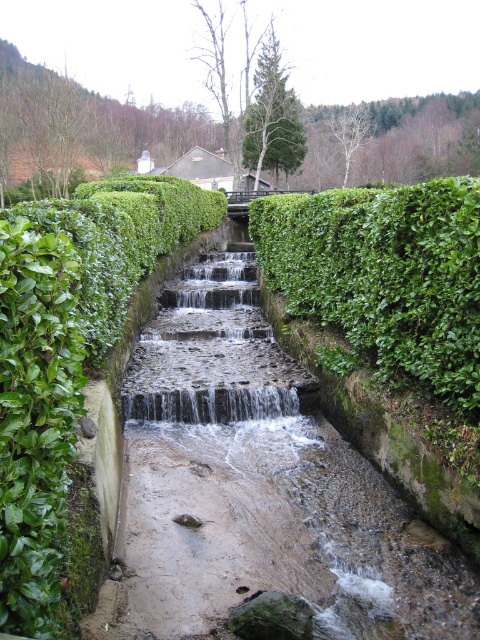
Is green leafy hedge at upper center behind smooth stone steps at center?

No, green leafy hedge at upper center is in front of smooth stone steps at center.

Does point (453, 358) come farther from viewer compared to point (151, 385)?

No.

Find the location of a particular element. The width and height of the screenshot is (480, 640). green leafy hedge at upper center is located at coordinates (385, 276).

Can you confirm if green leafy hedge at upper center is positioned to the right of clear water at center?

Indeed, green leafy hedge at upper center is positioned on the right side of clear water at center.

Is point (462, 236) farther from camera compared to point (276, 404)?

No, it is in front of (276, 404).

Locate an element on the screen. The width and height of the screenshot is (480, 640). green leafy hedge at upper center is located at coordinates (385, 276).

This screenshot has width=480, height=640. What do you see at coordinates (36, 417) in the screenshot?
I see `green leafy hedge at center` at bounding box center [36, 417].

Is green leafy hedge at center bigger than smooth stone steps at center?

No.

The width and height of the screenshot is (480, 640). What are the coordinates of `green leafy hedge at center` in the screenshot? It's located at (36, 417).

Where is `green leafy hedge at center`? The width and height of the screenshot is (480, 640). green leafy hedge at center is located at coordinates (36, 417).